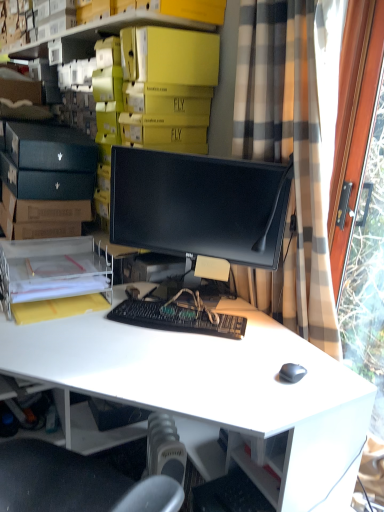
Where is `free space to the left of black matte keyboard at center`? The image size is (384, 512). free space to the left of black matte keyboard at center is located at coordinates (82, 324).